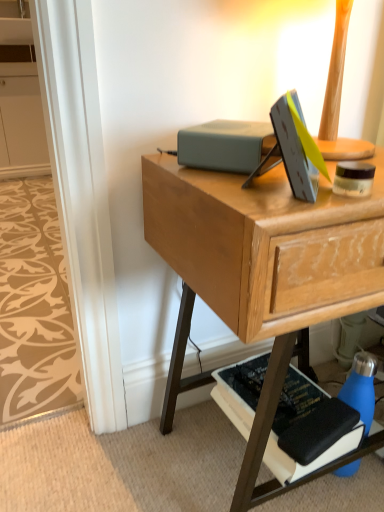
You are a GUI agent. You are given a task and a screenshot of the screen. Output one action in this format:
    pyautogui.click(x=<x>, y=<y>)
    Task: Click on the free space in front of matte gray book at center, positioned as the 2th paperback book in bottom-to-top order
    
    Given the screenshot: What is the action you would take?
    pyautogui.click(x=256, y=185)